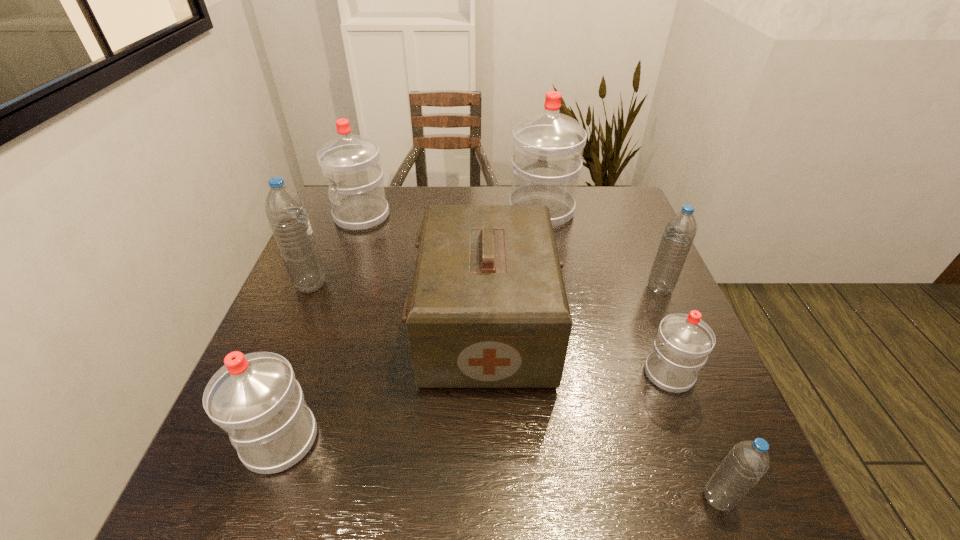
This screenshot has width=960, height=540. I want to click on object that is positioned at the near left corner, so click(x=254, y=398).

Locate an element on the screen. object situated at the near right corner is located at coordinates (746, 463).

You are a GUI agent. You are given a task and a screenshot of the screen. Output one action in this format:
    pyautogui.click(x=<x>, y=<y>)
    Task: Click on the vacant space at the far edge
    The image size is (960, 540).
    Given the screenshot: What is the action you would take?
    pyautogui.click(x=406, y=220)

The image size is (960, 540). In the image, there is a desktop. What are the coordinates of `vacant space at the near edge` in the screenshot? It's located at (556, 480).

What are the coordinates of `vacant space at the left edge of the desktop` in the screenshot? It's located at (303, 314).

Identify the location of free space at the right edge. (628, 294).

In the image, there is a desktop. Identify the location of vacant space at the far left corner. (325, 223).

The height and width of the screenshot is (540, 960). I want to click on free region at the far right corner of the desktop, so click(x=618, y=222).

The width and height of the screenshot is (960, 540). What are the coordinates of `unoccupied position between the tallest object and the second smallest blue water bottle` in the screenshot? It's located at (600, 249).

You are a GUI agent. You are given a task and a screenshot of the screen. Output one action in this format:
    pyautogui.click(x=<x>, y=<y>)
    Task: Click on the free space between the third biggest white water bottle and the biggest blue water bottle
    The width and height of the screenshot is (960, 540).
    Given the screenshot: What is the action you would take?
    pyautogui.click(x=296, y=362)